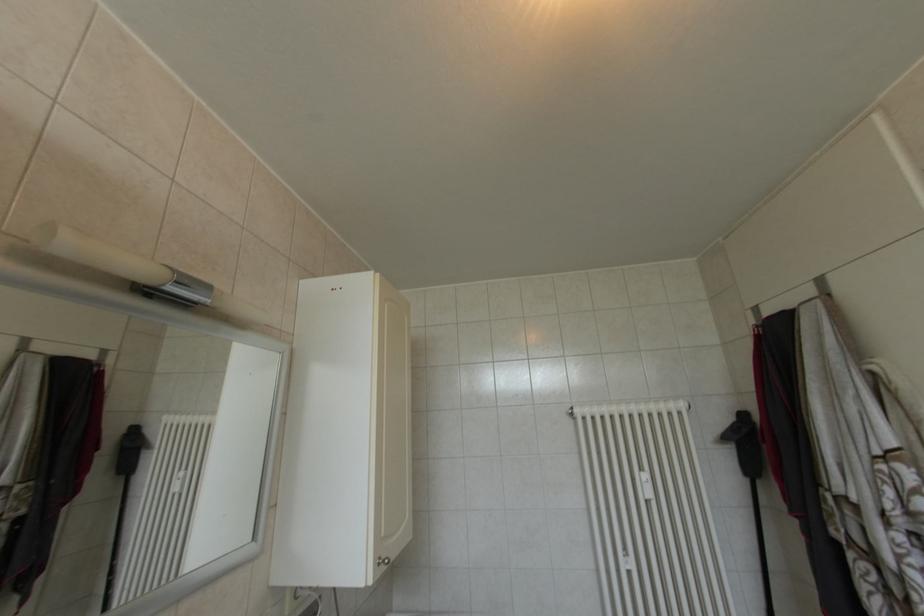
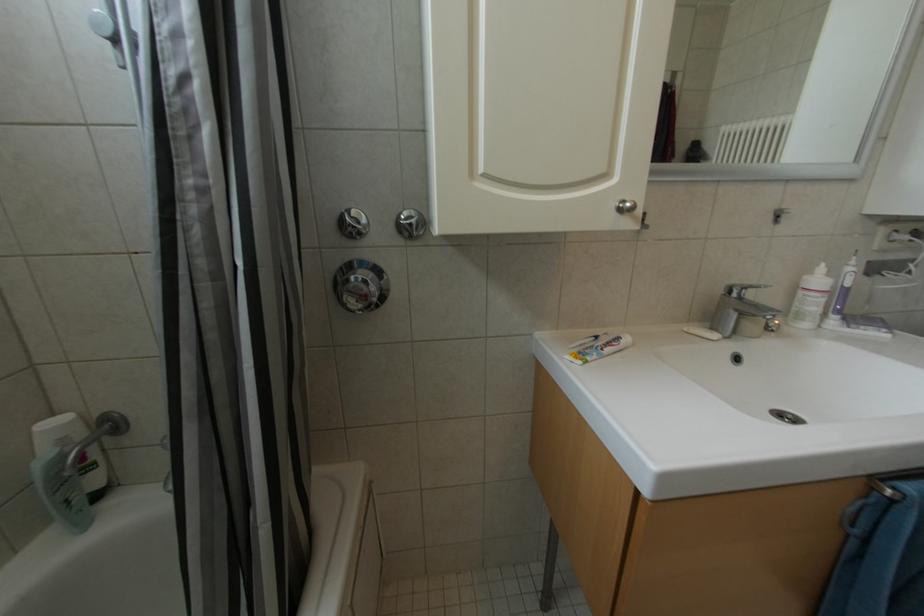
The first image is from the beginning of the video and the second image is from the end. How did the camera likely rotate when shooting the video?

The camera rotated toward left-down.